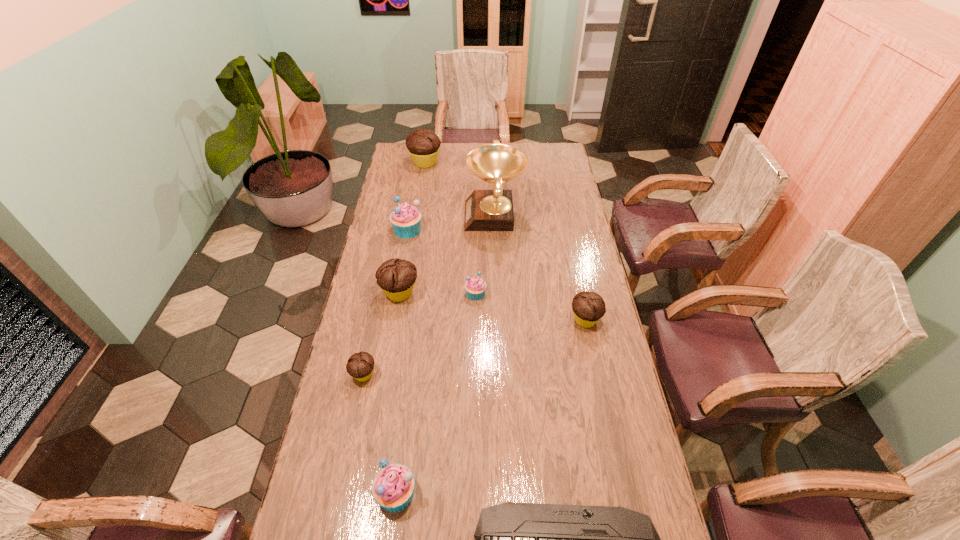
Identify the location of free space located on the right of the second biggest blue muffin. Image resolution: width=960 pixels, height=540 pixels. (470, 493).

Identify the location of vacant space located 0.370m on the left of the rightmost chocolate muffin. (465, 320).

At what (x,y) coordinates should I click in order to perform the action: click on vacant space located on the front of the sixth muffin from left to right. Please return your answer as a coordinate pair (x, y). The image size is (960, 540). Looking at the image, I should click on (475, 377).

In order to click on vacant point located on the back of the smallest chocolate muffin in this screenshot , I will do `click(376, 313)`.

Locate an element on the screen. object present at the far edge is located at coordinates (423, 145).

Locate an element on the screen. The height and width of the screenshot is (540, 960). object at the right edge is located at coordinates (588, 307).

The width and height of the screenshot is (960, 540). In order to click on object at the far left corner in this screenshot , I will do `click(423, 145)`.

In order to click on free space at the left edge in this screenshot , I will do `click(388, 215)`.

Where is `free location at the right edge`? The image size is (960, 540). free location at the right edge is located at coordinates (626, 448).

I want to click on vacant space that is in between the second nearest muffin and the rightmost blue muffin, so click(420, 334).